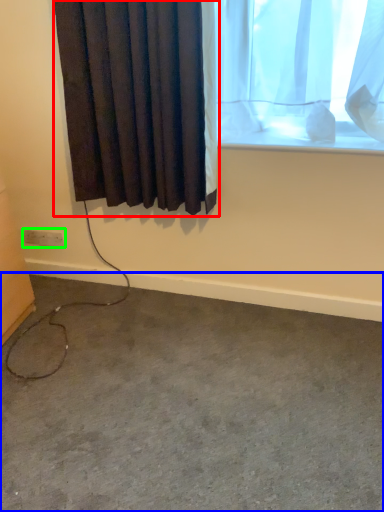
Question: Which object is the closest to the curtain (highlighted by a red box)? Choose among these: concrete (highlighted by a blue box) or electric outlet (highlighted by a green box).

Choices:
 (A) concrete
 (B) electric outlet

Answer: (B)